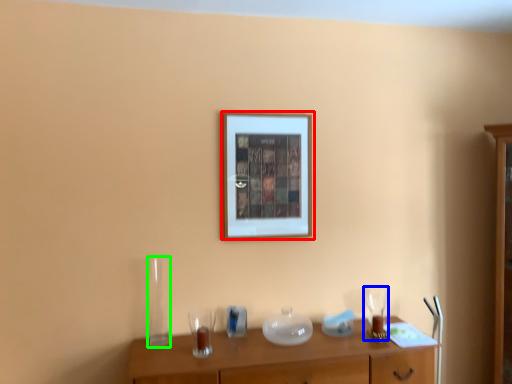
Question: Estimate the real-world distances between objects in this image. Which object is closer to picture frame (highlighted by a red box), wine glass (highlighted by a blue box) or glass vase (highlighted by a green box)?

Choices:
 (A) wine glass
 (B) glass vase

Answer: (B)